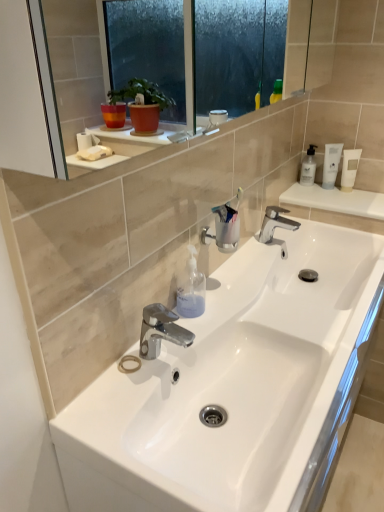
Find the location of `free location to the left of chrome metallic faucet at center, the 2th tap viewed from the right`. free location to the left of chrome metallic faucet at center, the 2th tap viewed from the right is located at coordinates (110, 383).